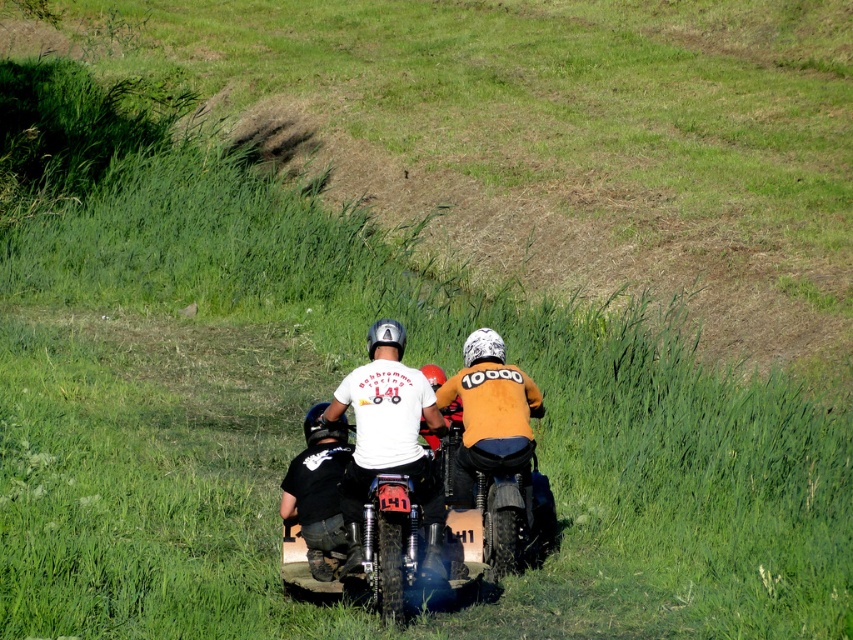
Question: Is white matte t-shirt at center further to camera compared to black matte pants at center?

Choices:
 (A) yes
 (B) no

Answer: (B)

Question: Which of the following is the closest to the observer?

Choices:
 (A) (364, 483)
 (B) (344, 465)

Answer: (A)

Question: Is white matte t-shirt at center in front of black matte pants at center?

Choices:
 (A) yes
 (B) no

Answer: (A)

Question: Which point is closer to the camera?

Choices:
 (A) black matte pants at center
 (B) white matte t-shirt at center

Answer: (B)

Question: Is white matte t-shirt at center further to camera compared to black matte pants at center?

Choices:
 (A) yes
 (B) no

Answer: (B)